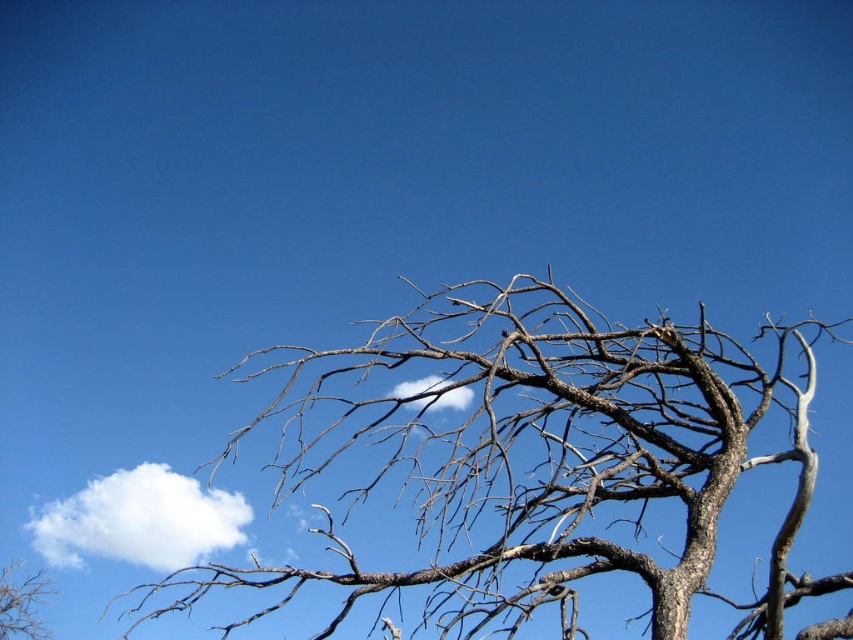
Question: Which of the following is the farthest from the observer?

Choices:
 (A) white fluffy cloud at center
 (B) white fluffy cloud at upper left
 (C) brown rough tree at center
 (D) brown rough tree at lower left

Answer: (D)

Question: Can you confirm if white fluffy cloud at upper left is smaller than white fluffy cloud at center?

Choices:
 (A) yes
 (B) no

Answer: (B)

Question: Is white fluffy cloud at upper left below brown rough tree at lower left?

Choices:
 (A) yes
 (B) no

Answer: (B)

Question: Is brown rough tree at center wider than brown rough tree at lower left?

Choices:
 (A) no
 (B) yes

Answer: (B)

Question: Which point is farther to the camera?

Choices:
 (A) brown rough tree at center
 (B) white fluffy cloud at upper left
 (C) brown rough tree at lower left

Answer: (C)

Question: Which of the following is the closest to the observer?

Choices:
 (A) (361, 397)
 (B) (25, 588)
 (C) (102, 536)
 (D) (432, 408)

Answer: (A)